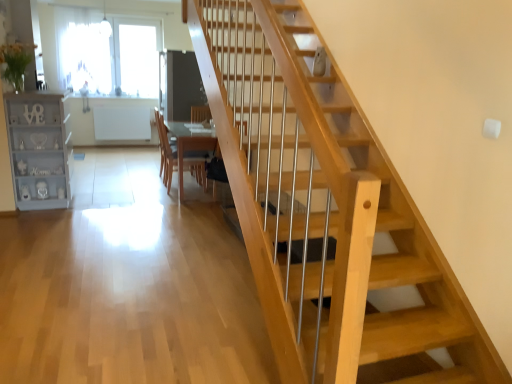
Question: Does wooden at center appear on the right side of light gray painted wood bookshelf at left?

Choices:
 (A) no
 (B) yes

Answer: (B)

Question: Is wooden at center behind light gray painted wood bookshelf at left?

Choices:
 (A) no
 (B) yes

Answer: (B)

Question: Does wooden at center have a lesser width compared to light gray painted wood bookshelf at left?

Choices:
 (A) yes
 (B) no

Answer: (A)

Question: Can light gray painted wood bookshelf at left be found inside wooden at center?

Choices:
 (A) no
 (B) yes

Answer: (A)

Question: Can you confirm if wooden at center is smaller than light gray painted wood bookshelf at left?

Choices:
 (A) no
 (B) yes

Answer: (B)

Question: In the image, is wooden at center on the left side or the right side of light gray painted wood bookshelf at left?

Choices:
 (A) right
 (B) left

Answer: (A)

Question: Looking at the image, does wooden at center seem bigger or smaller compared to light gray painted wood bookshelf at left?

Choices:
 (A) small
 (B) big

Answer: (A)

Question: From a real-world perspective, is wooden at center positioned above or below light gray painted wood bookshelf at left?

Choices:
 (A) above
 (B) below

Answer: (B)

Question: In terms of height, does wooden at center look taller or shorter compared to light gray painted wood bookshelf at left?

Choices:
 (A) tall
 (B) short

Answer: (B)

Question: In the image, is wooden at center positioned in front of or behind transparent glass window at upper left?

Choices:
 (A) front
 (B) behind

Answer: (A)

Question: Does point (207, 142) appear closer or farther from the camera than point (136, 26)?

Choices:
 (A) closer
 (B) farther

Answer: (A)

Question: Considering the relative positions of wooden at center and transparent glass window at upper left in the image provided, is wooden at center to the left or to the right of transparent glass window at upper left?

Choices:
 (A) right
 (B) left

Answer: (A)

Question: In terms of height, does wooden at center look taller or shorter compared to transparent glass window at upper left?

Choices:
 (A) short
 (B) tall

Answer: (A)

Question: Considering the relative positions of light gray painted wood bookshelf at left and transparent glass window at upper left in the image provided, is light gray painted wood bookshelf at left to the left or to the right of transparent glass window at upper left?

Choices:
 (A) right
 (B) left

Answer: (A)

Question: From their relative heights in the image, would you say light gray painted wood bookshelf at left is taller or shorter than transparent glass window at upper left?

Choices:
 (A) tall
 (B) short

Answer: (B)